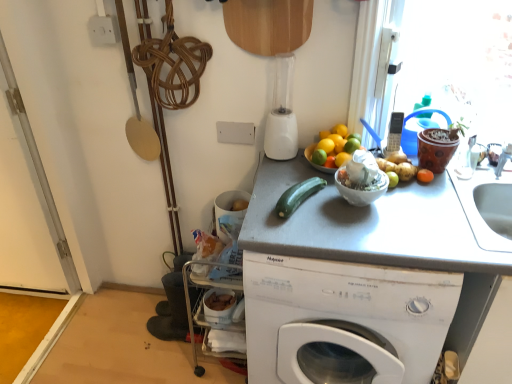
This screenshot has width=512, height=384. In order to click on vacant space to the right of orange matte at right in this screenshot , I will do `click(460, 183)`.